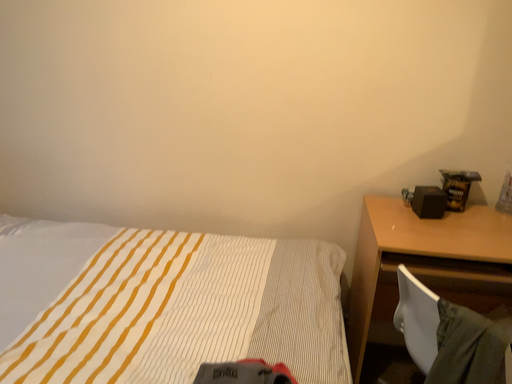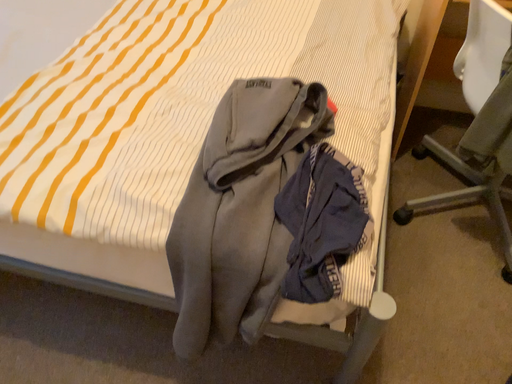
Question: Which way did the camera rotate in the video?

Choices:
 (A) rotated upward
 (B) rotated downward

Answer: (B)